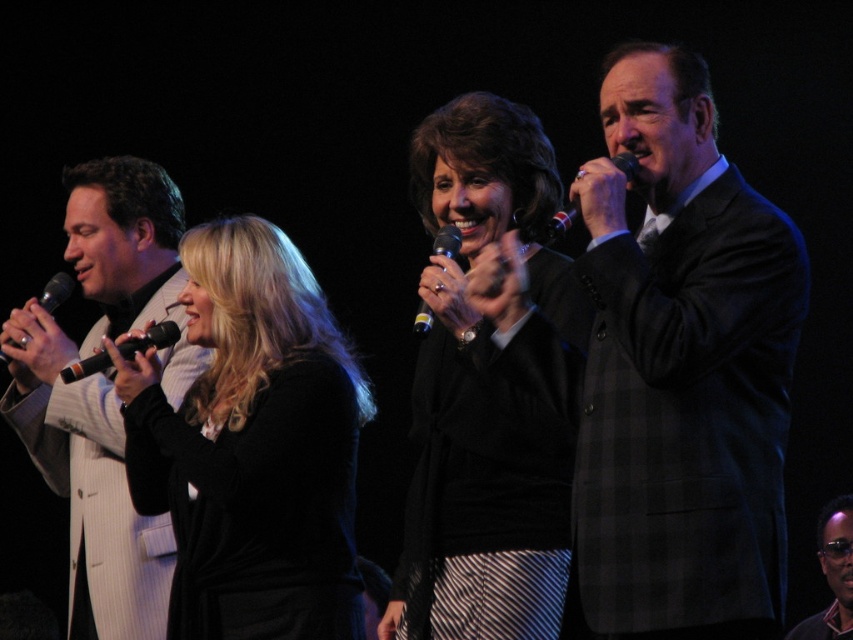
In the dimly lit stage scene, you see a black matte sweater at center and a black plastic microphone at left. Which object is positioned to the right of the other?

The black matte sweater at center is to the right of the black plastic microphone at left.

You are an audience member sitting in the front row of the theater. You notice two performers wearing black velvet dress at center and black textured suit at center. Which performer is standing closer to the front of the stage?

The black velvet dress at center is closer to the viewer than the black textured suit at center, so the performer wearing the black velvet dress at center is standing closer to the front of the stage.